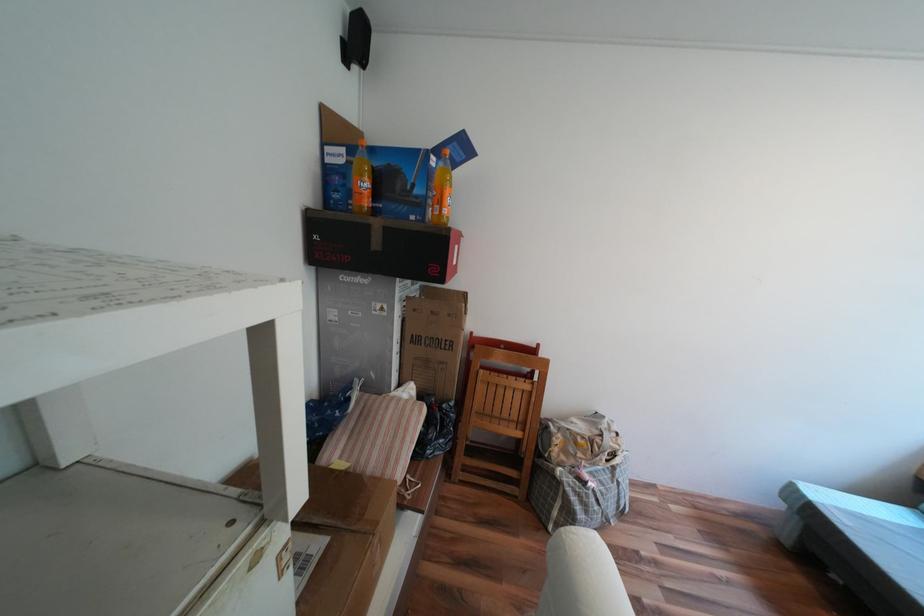
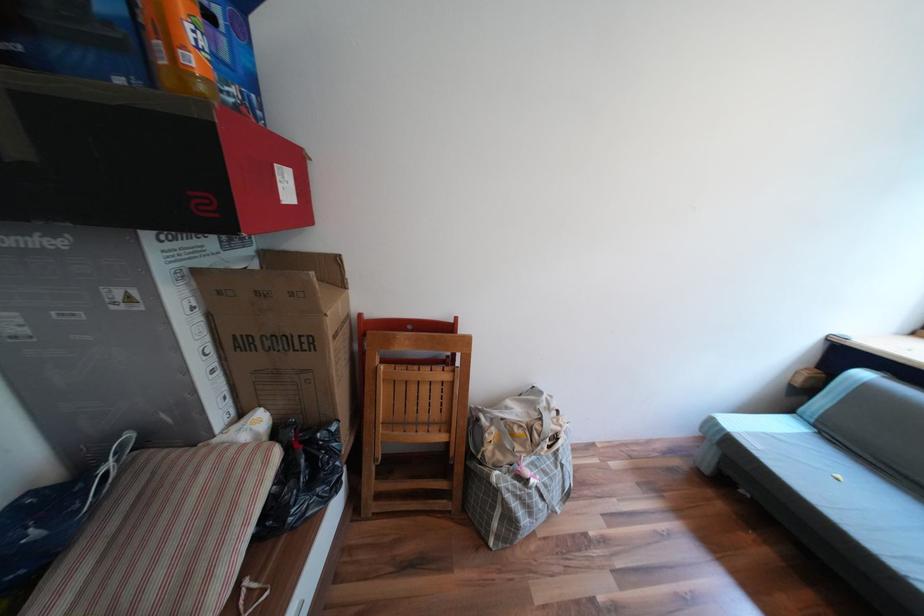
Find the pixel in the second image that matches (455,211) in the first image.

(201, 61)